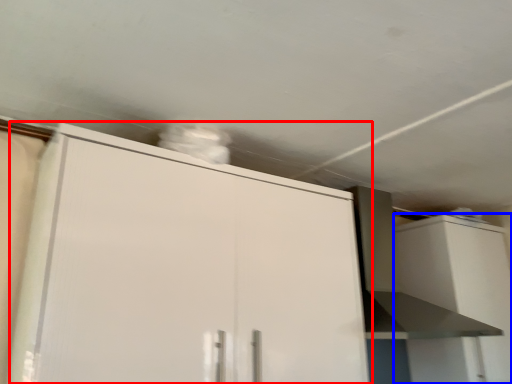
Question: Which object is further to the camera taking this photo, cabinetry (highlighted by a red box) or cabinetry (highlighted by a blue box)?

Choices:
 (A) cabinetry
 (B) cabinetry

Answer: (B)